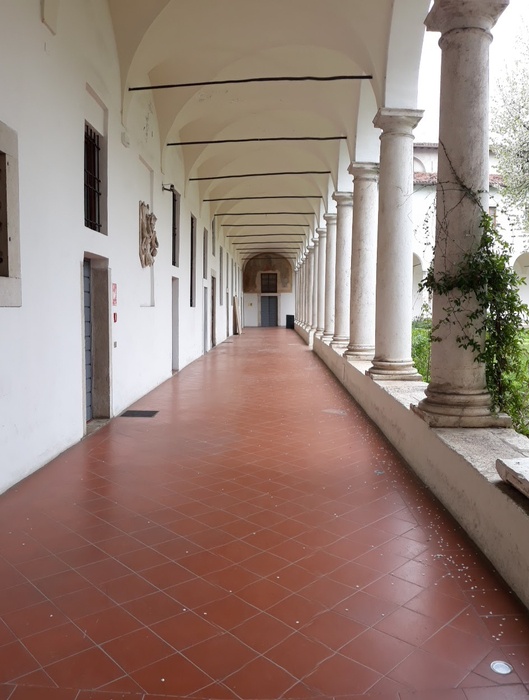
Locate an element on the screen. door is located at coordinates (269, 313).